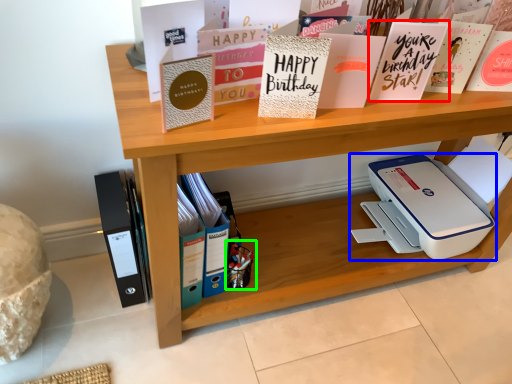
Question: Which object is the farthest from paperback book (highlighted by a red box)? Choose among these: printer (highlighted by a blue box) or toy (highlighted by a green box).

Choices:
 (A) printer
 (B) toy

Answer: (B)